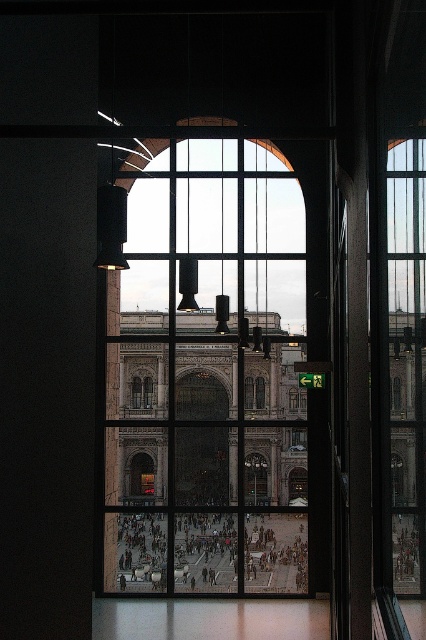
Question: Can you confirm if clear glass window at center is positioned above clear glass window at right?

Choices:
 (A) no
 (B) yes

Answer: (B)

Question: Which of the following is the farthest from the observer?

Choices:
 (A) clear glass window at right
 (B) clear glass window at center

Answer: (B)

Question: Is clear glass window at center to the left of clear glass window at right from the viewer's perspective?

Choices:
 (A) yes
 (B) no

Answer: (A)

Question: Is clear glass window at center wider than clear glass window at right?

Choices:
 (A) yes
 (B) no

Answer: (A)